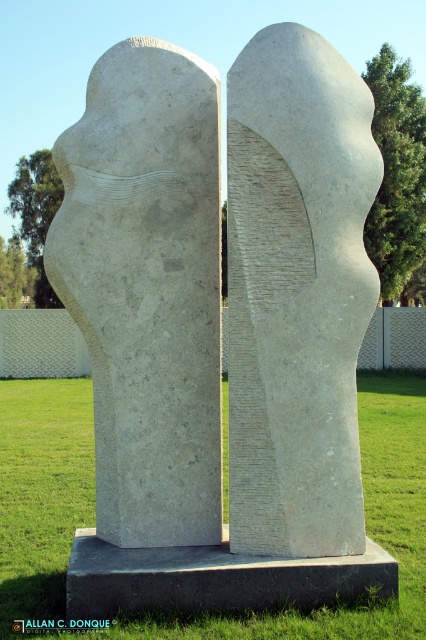
Question: Which object is positioned farthest from the white stone sculpture at center?

Choices:
 (A) green grass at center
 (B) gray concrete at center

Answer: (A)

Question: Which of the following is the closest to the observer?

Choices:
 (A) (94, 572)
 (B) (236, 346)
 (C) (368, 385)

Answer: (A)

Question: From the image, what is the correct spatial relationship of white stone sculpture at center in relation to green grass at center?

Choices:
 (A) right
 (B) left

Answer: (A)

Question: In this image, where is white stone sculpture at center located relative to green grass at center?

Choices:
 (A) right
 (B) left

Answer: (A)

Question: Which of the following is the closest to the observer?

Choices:
 (A) white stone sculpture at center
 (B) green grass at center

Answer: (B)

Question: Is green grass at center thinner than gray concrete at center?

Choices:
 (A) no
 (B) yes

Answer: (A)